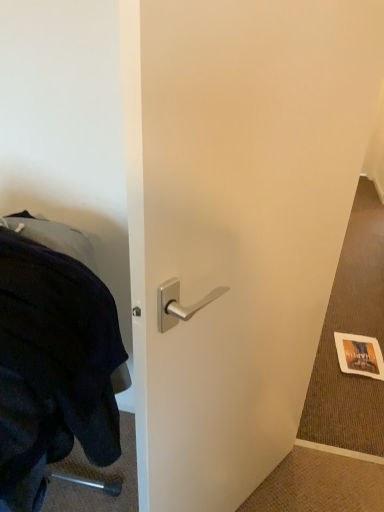
Question: From their relative heights in the image, would you say gold textured paper at lower right is taller or shorter than satin silver handle at center?

Choices:
 (A) tall
 (B) short

Answer: (B)

Question: Looking at the image, does gold textured paper at lower right seem bigger or smaller compared to satin silver handle at center?

Choices:
 (A) big
 (B) small

Answer: (B)

Question: Estimate the real-world distances between objects in this image. Which object is farther from the gold textured paper at lower right?

Choices:
 (A) black fabric at left
 (B) satin silver handle at center

Answer: (A)

Question: Which is farther from the satin silver handle at center?

Choices:
 (A) gold textured paper at lower right
 (B) black fabric at left

Answer: (A)